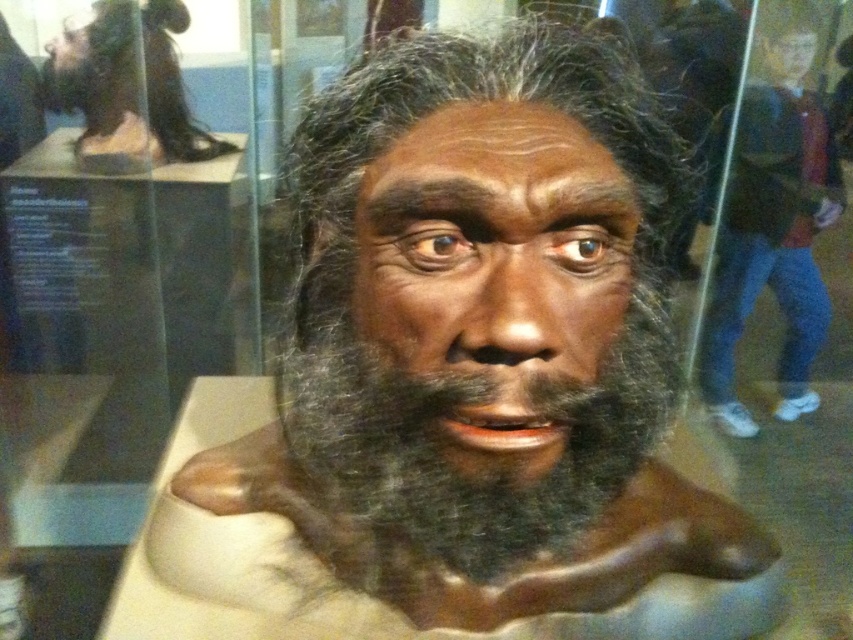
Does matte brown face at center have a smaller size compared to dark brown fur at center?

Yes.

Who is shorter, matte brown face at center or dark brown fur at center?

matte brown face at center is shorter.

Describe the element at coordinates (495, 269) in the screenshot. I see `matte brown face at center` at that location.

You are a GUI agent. You are given a task and a screenshot of the screen. Output one action in this format:
    pyautogui.click(x=<x>, y=<y>)
    Task: Click on the matte brown face at center
    The image size is (853, 640).
    Given the screenshot: What is the action you would take?
    pyautogui.click(x=495, y=269)

Between blue jeans at right and matte brown bust at center, which one has more height?

With more height is blue jeans at right.

Can you confirm if blue jeans at right is taller than matte brown bust at center?

Correct, blue jeans at right is much taller as matte brown bust at center.

Locate an element on the screen. Image resolution: width=853 pixels, height=640 pixels. blue jeans at right is located at coordinates (769, 227).

Does brown matte sculpture at center lie in front of matte brown face at center?

No, brown matte sculpture at center is further to the viewer.

Between point (437, 44) and point (447, 342), which one is positioned in front?

Positioned in front is point (447, 342).

Does point (614, 305) come closer to viewer compared to point (462, 115)?

No, (614, 305) is behind (462, 115).

Where is `brown matte sculpture at center`? The height and width of the screenshot is (640, 853). brown matte sculpture at center is located at coordinates (480, 342).